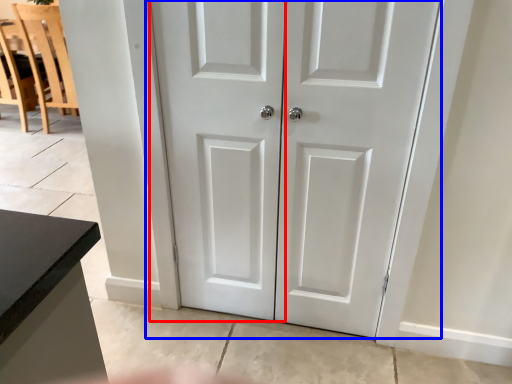
Question: Which object appears closest to the camera in this image, screen door (highlighted by a red box) or door (highlighted by a blue box)?

Choices:
 (A) screen door
 (B) door

Answer: (B)